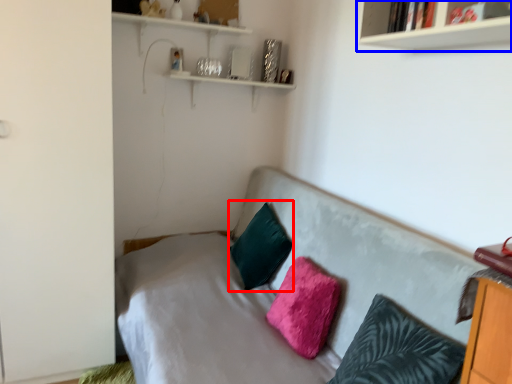
Question: Among these objects, which one is farthest to the camera, pillow (highlighted by a red box) or shelf (highlighted by a blue box)?

Choices:
 (A) pillow
 (B) shelf

Answer: (A)